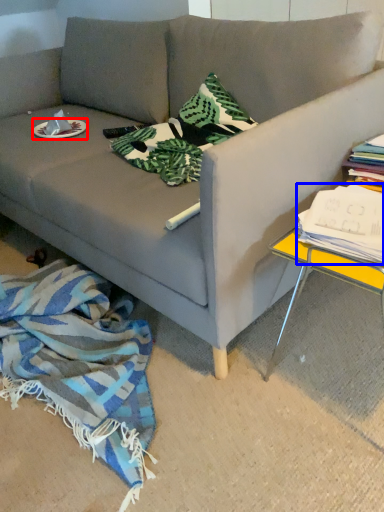
Question: Among these objects, which one is farthest to the camera, plate (highlighted by a red box) or magazine (highlighted by a blue box)?

Choices:
 (A) plate
 (B) magazine

Answer: (A)